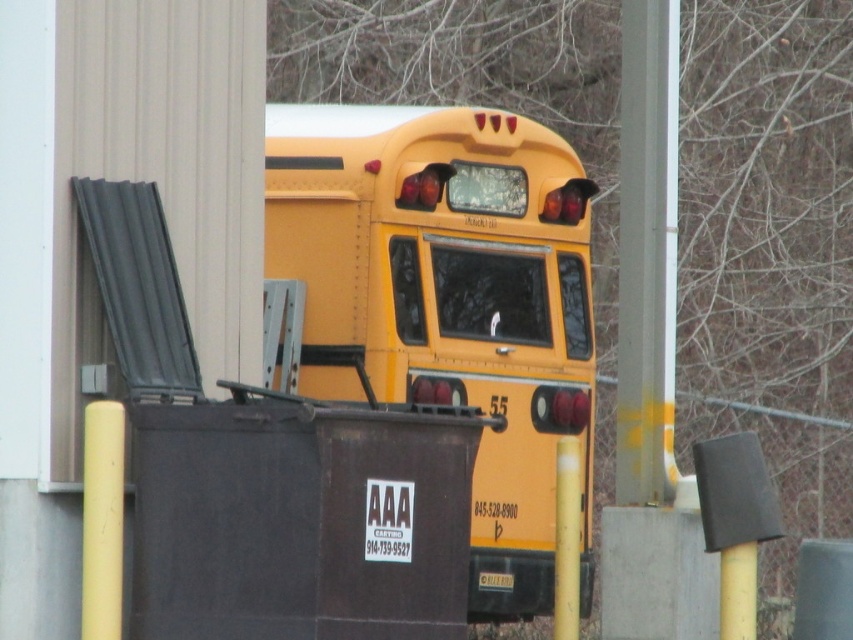
Question: Can you confirm if yellow matte school bus at center is positioned to the left of yellow matte pole at center?

Choices:
 (A) no
 (B) yes

Answer: (B)

Question: Is yellow matte school bus at center positioned in front of yellow matte pole at center?

Choices:
 (A) yes
 (B) no

Answer: (B)

Question: Which point is closer to the camera?

Choices:
 (A) yellow matte pole at center
 (B) yellow matte school bus at center

Answer: (A)

Question: In this image, where is yellow matte school bus at center located relative to yellow matte pole at center?

Choices:
 (A) below
 (B) above

Answer: (B)

Question: Which point is farther to the camera?

Choices:
 (A) yellow matte school bus at center
 (B) yellow matte pole at center

Answer: (A)